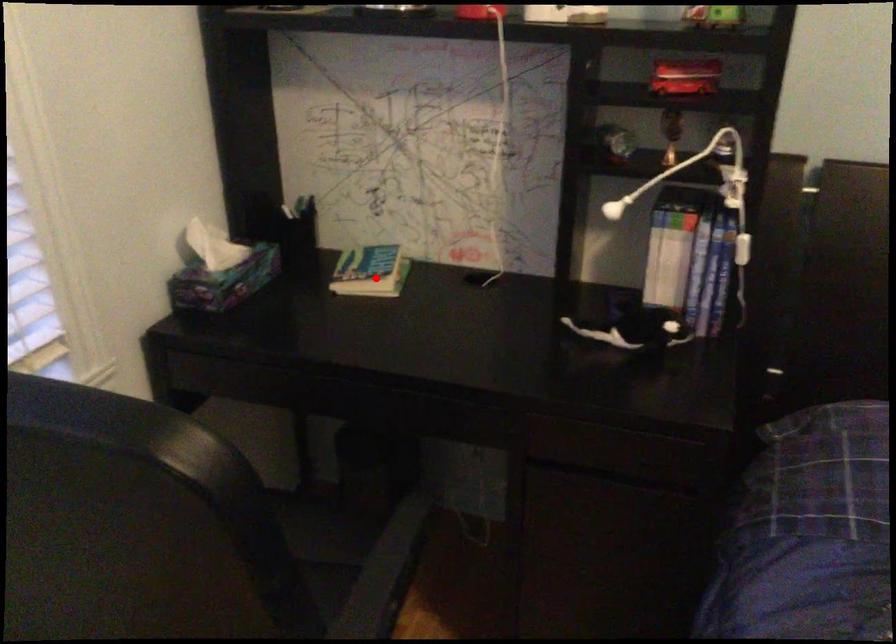
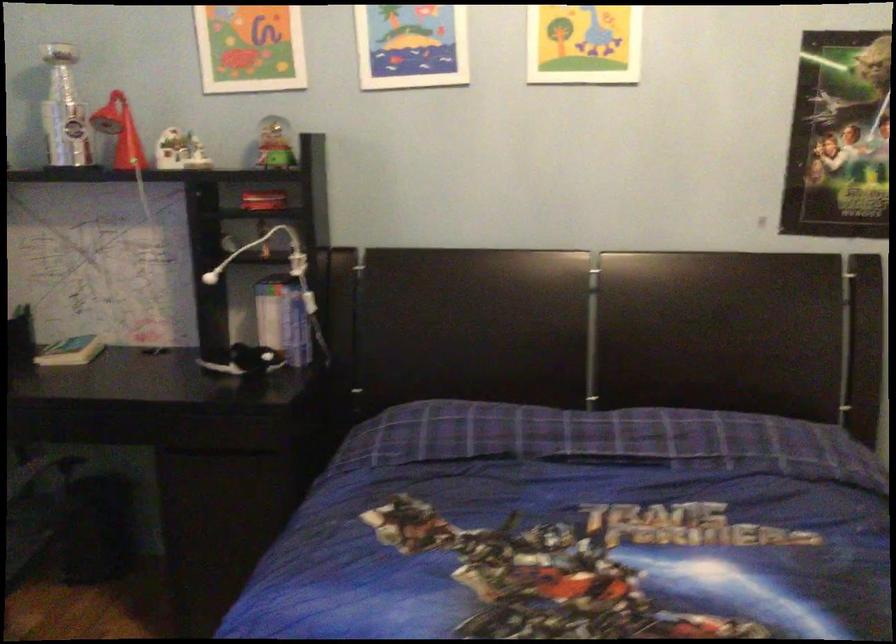
Question: A red point is marked in image1. In image2, is the corresponding 3D point closer to the camera or farther? Reply with the corresponding letter.

Choices:
 (A) The corresponding 3D point is closer.
 (B) The corresponding 3D point is farther.

Answer: (B)